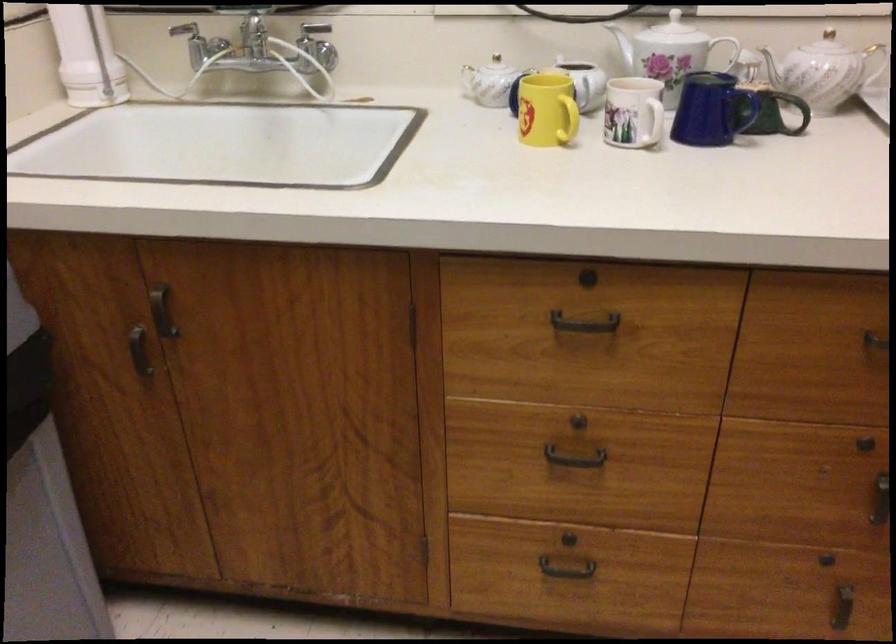
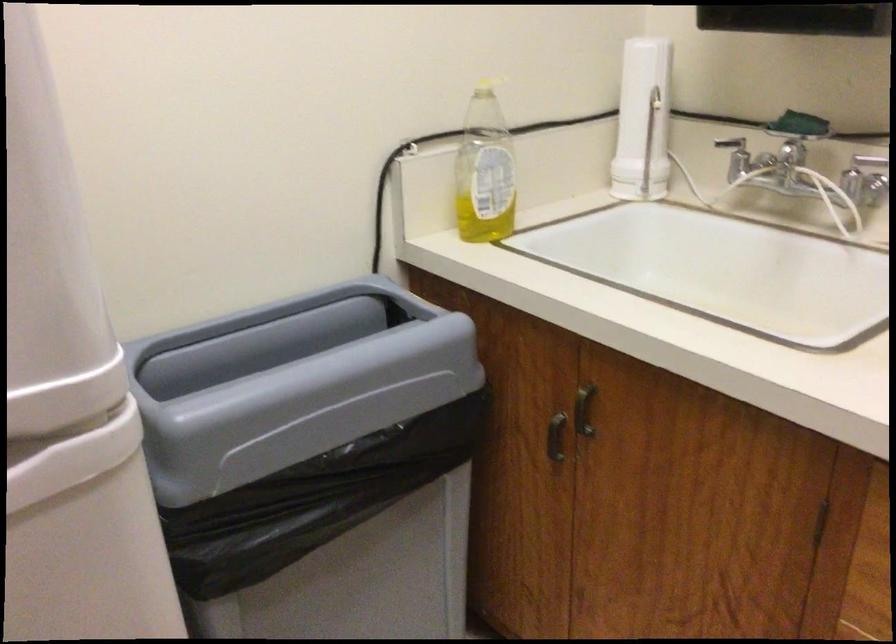
Question: The camera is either moving clockwise (left) or counter-clockwise (right) around the object. The first image is from the beginning of the video and the second image is from the end. Is the camera moving left or right when shooting the video?

Choices:
 (A) Left
 (B) Right

Answer: (B)